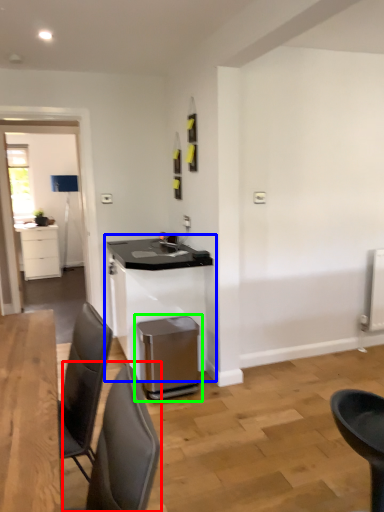
Question: Which object is the farthest from chair (highlighted by a red box)? Choose among these: table (highlighted by a blue box) or waste container (highlighted by a green box).

Choices:
 (A) table
 (B) waste container

Answer: (A)